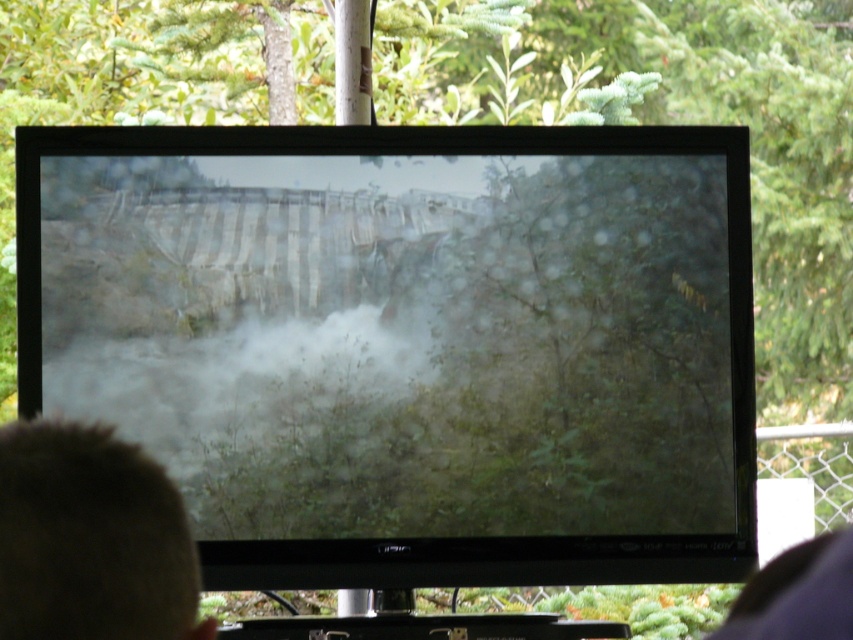
Locate an element on the screen. This screenshot has width=853, height=640. matte black monitor at center is located at coordinates pos(408,342).

Does point (312, 500) lie in front of point (142, 554)?

No.

Where is `matte black monitor at center`? The width and height of the screenshot is (853, 640). matte black monitor at center is located at coordinates (408, 342).